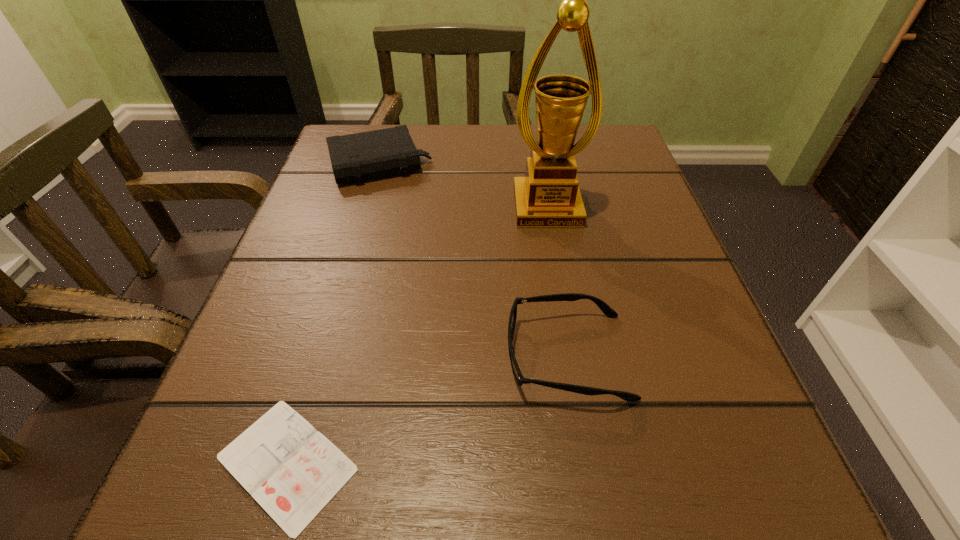
Locate an element on the screen. free point at the left edge is located at coordinates (340, 296).

I want to click on vacant space at the right edge of the desktop, so click(636, 217).

Identify the location of blank space at the far right corner. (630, 167).

Where is `vacant space at the near right corner`? vacant space at the near right corner is located at coordinates (714, 511).

The image size is (960, 540). What are the coordinates of `empty space between the spectacles and the diary` in the screenshot? It's located at (427, 409).

Where is `free space between the spectacles and the award`? The image size is (960, 540). free space between the spectacles and the award is located at coordinates (557, 282).

Identify the location of free point between the shortest object and the Bible. This screenshot has width=960, height=540. (333, 313).

This screenshot has height=540, width=960. I want to click on free space between the spectacles and the Bible, so click(473, 260).

The width and height of the screenshot is (960, 540). What are the coordinates of `vacant area that lies between the award and the diary` in the screenshot? It's located at (417, 335).

Where is `free space between the diary and the Bible`? This screenshot has height=540, width=960. free space between the diary and the Bible is located at coordinates (333, 313).